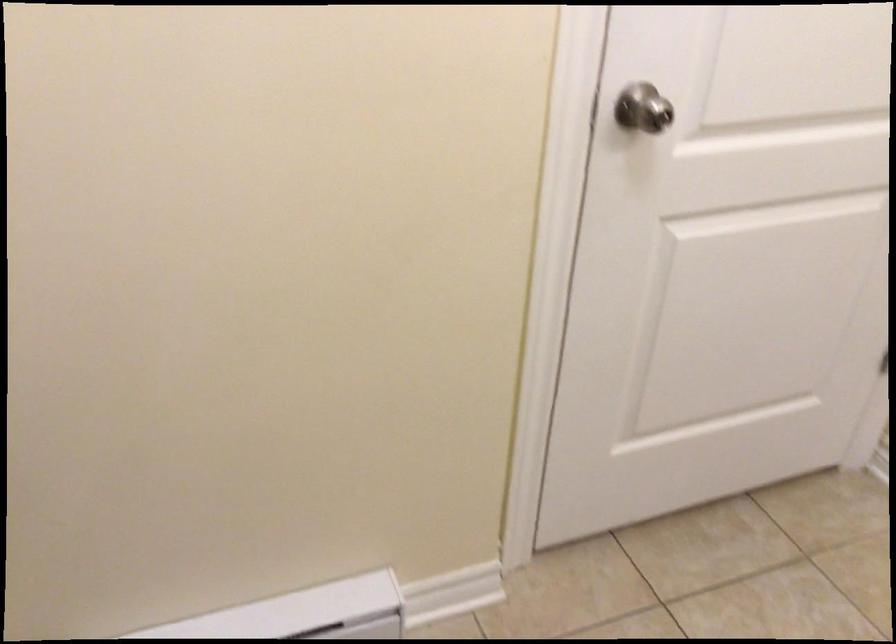
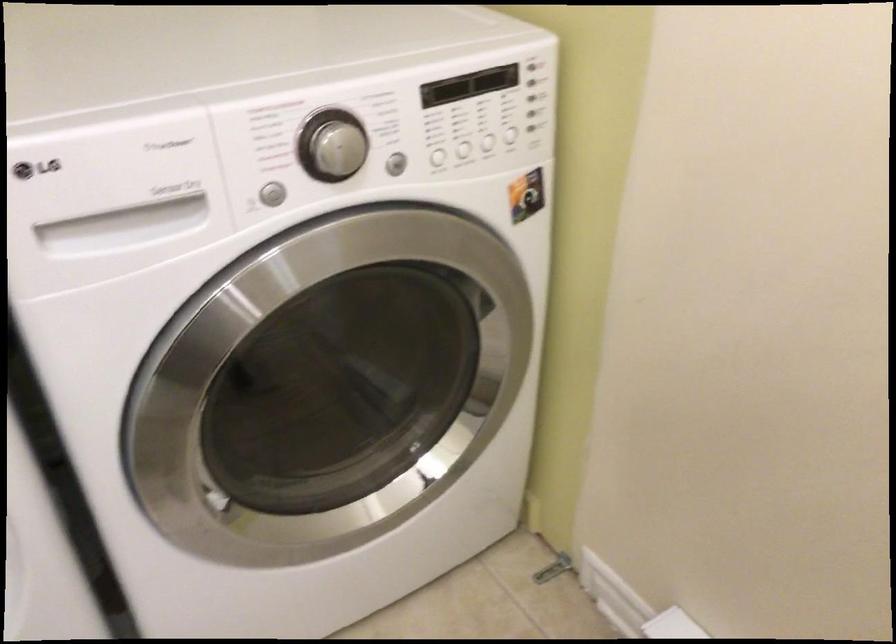
The images are taken continuously from a first-person perspective. In which direction is your viewpoint rotating?

The camera's rotation is toward left-down.